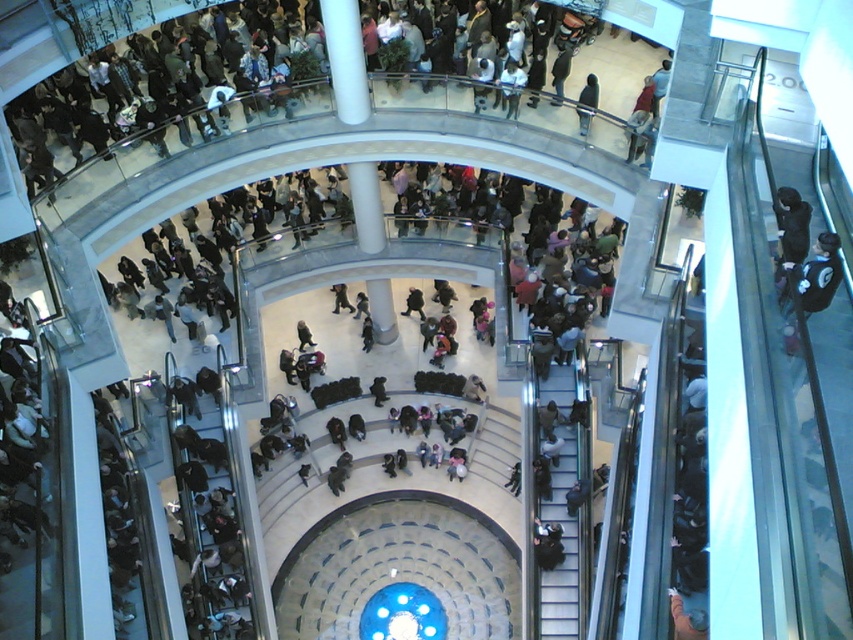
You are standing in the shopping mall and want to take a photo of the translucent glass dome at center without any people blocking it. The dark blue jacket at center is currently in the way. Based on their positions, can you move forward or backward to get a clear shot?

The translucent glass dome at center is further to the viewer than dark blue jacket at center. Moving forward would bring you closer to the dome and away from the jacket, potentially allowing you to position yourself so the dome is in front of the jacket in the frame, thus avoiding obstruction.

You are standing at the center of the central atrium and want to reach the metallic gray escalator at lower right. Based on your current position, in which direction should you walk to reach it?

You should walk toward the lower right direction to reach the metallic gray escalator at lower right since it is located at point (564, 547), which is in the lower right quadrant of the image.

You are standing in the mall and want to know if the translucent glass dome at center is within a 10 meter radius of the dark blue jacket at center. Based on the scene, can you confirm this?

The distance between the translucent glass dome at center and the dark blue jacket at center is 13.43 meters, which is beyond the 10 meter radius. Therefore, the dome is not within 10 meters of the jacket.